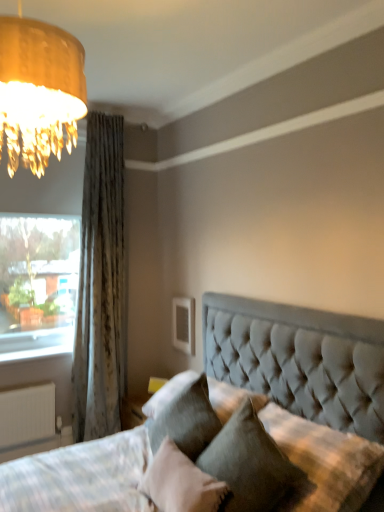
Question: From a real-world perspective, is yellow fabric table lamp at lower center physically above clear glass window at left?

Choices:
 (A) no
 (B) yes

Answer: (A)

Question: Is yellow fabric table lamp at lower center positioned behind clear glass window at left?

Choices:
 (A) yes
 (B) no

Answer: (A)

Question: Can you confirm if yellow fabric table lamp at lower center is smaller than clear glass window at left?

Choices:
 (A) yes
 (B) no

Answer: (A)

Question: Is yellow fabric table lamp at lower center facing towards clear glass window at left?

Choices:
 (A) no
 (B) yes

Answer: (A)

Question: Is yellow fabric table lamp at lower center wider than clear glass window at left?

Choices:
 (A) no
 (B) yes

Answer: (A)

Question: Is yellow fabric table lamp at lower center closer to camera compared to clear glass window at left?

Choices:
 (A) no
 (B) yes

Answer: (A)

Question: Is textured gray curtain at left further to the viewer compared to tufted fabric pillow at center, the second pillow from the left?

Choices:
 (A) yes
 (B) no

Answer: (A)

Question: Does textured gray curtain at left appear on the right side of tufted fabric pillow at center, the second pillow from the left?

Choices:
 (A) no
 (B) yes

Answer: (A)

Question: Can you confirm if textured gray curtain at left is bigger than tufted fabric pillow at center, positioned as the 1th pillow in right-to-left order?

Choices:
 (A) no
 (B) yes

Answer: (B)

Question: Considering the relative sizes of textured gray curtain at left and tufted fabric pillow at center, the second pillow from the left, in the image provided, is textured gray curtain at left taller than tufted fabric pillow at center, the second pillow from the left,?

Choices:
 (A) no
 (B) yes

Answer: (B)

Question: Are textured gray curtain at left and tufted fabric pillow at center, the second pillow from the left, beside each other?

Choices:
 (A) no
 (B) yes

Answer: (A)

Question: From the image's perspective, would you say textured gray curtain at left is positioned over tufted fabric pillow at center, the second pillow from the left?

Choices:
 (A) no
 (B) yes

Answer: (B)

Question: Is yellow fabric table lamp at lower center shorter than velvet gray pillow at lower center, which ranks as the 1th pillow in left-to-right order?

Choices:
 (A) no
 (B) yes

Answer: (B)